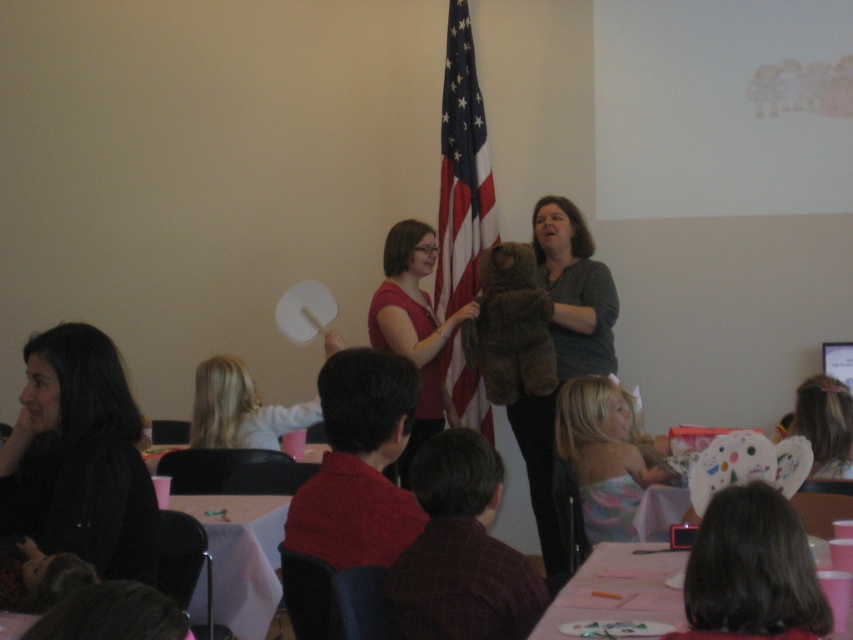
Question: Can you confirm if gray soft teddy bear at center is wider than matte white paper plate at lower right?

Choices:
 (A) no
 (B) yes

Answer: (B)

Question: Does black matte hair at lower left lie behind american flag at center?

Choices:
 (A) no
 (B) yes

Answer: (A)

Question: Which object is the closest to the white paper at lower left?

Choices:
 (A) gray soft teddy bear at center
 (B) pastel striped dress at lower center

Answer: (B)

Question: Estimate the real-world distances between objects in this image. Which object is closer to the matte white paper plate at lower right?

Choices:
 (A) black matte hair at lower left
 (B) brown fuzzy teddy bear at center

Answer: (B)

Question: Which of the following is the closest to the observer?

Choices:
 (A) (815, 440)
 (B) (270, 564)
 (C) (538, 333)
 (D) (552, 225)

Answer: (B)

Question: Is american flag at center closer to the viewer compared to pink paper plates at lower right?

Choices:
 (A) yes
 (B) no

Answer: (B)